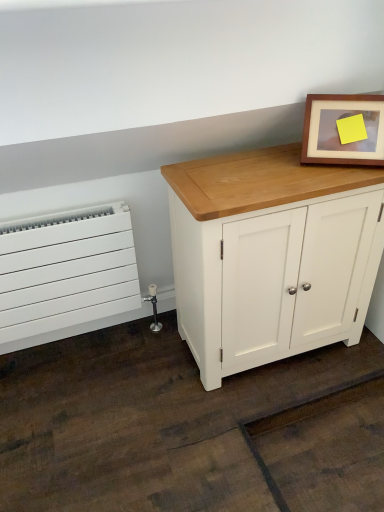
You are a GUI agent. You are given a task and a screenshot of the screen. Output one action in this format:
    pyautogui.click(x=<x>, y=<y>)
    Task: Click on the vacant point above white painted wood cabinet at center (from a real-world perspective)
    The image size is (384, 512).
    Given the screenshot: What is the action you would take?
    pyautogui.click(x=266, y=170)